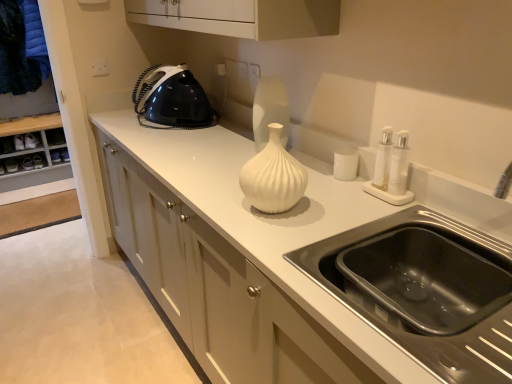
Image resolution: width=512 pixels, height=384 pixels. Find the location of `free space to the left of white matte vase at center`. free space to the left of white matte vase at center is located at coordinates (219, 203).